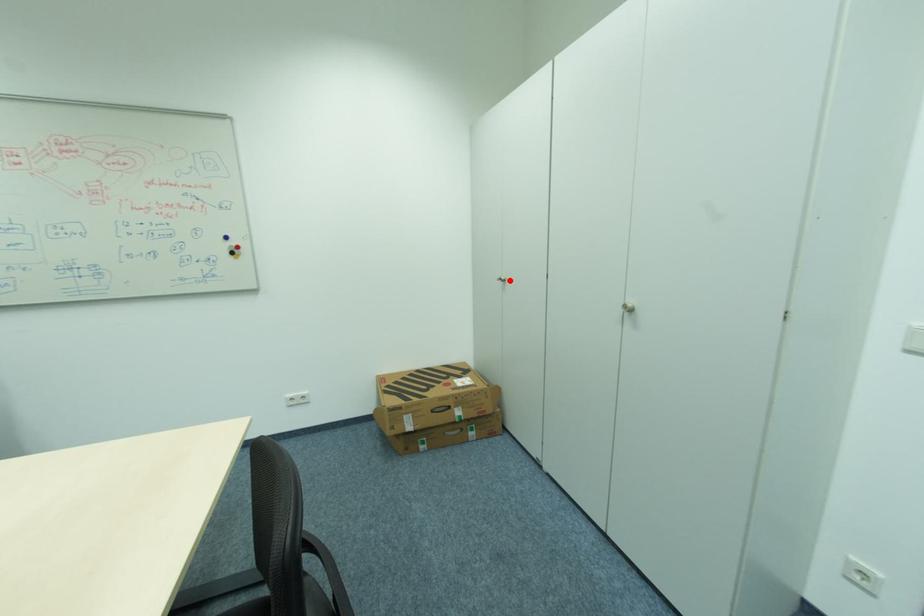
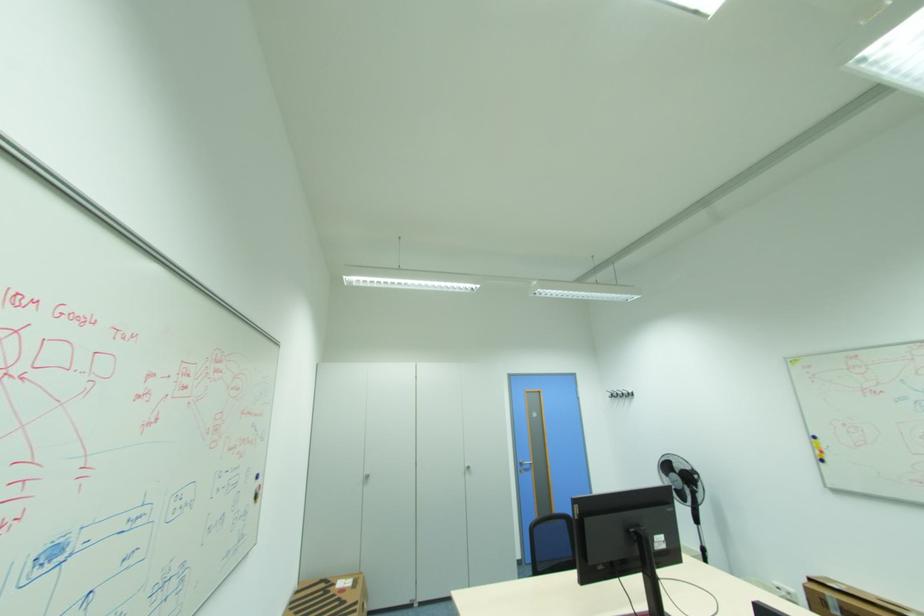
In the second image, find the point that corresponds to the highlighted location in the first image.

(372, 477)